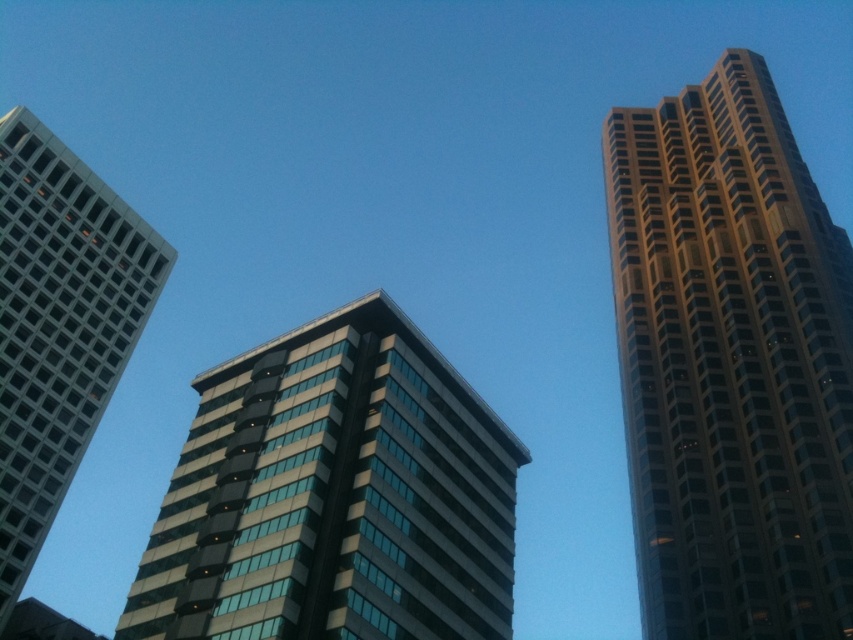
You are standing on the ground floor and want to take a photo of the gold glassy building at right and the matte glass skyscraper at left. Which building will appear larger in your photo?

The gold glassy building at right will appear larger in the photo because it is closer to the viewer than the matte glass skyscraper at left.

What is the significance of the point at coordinates (334,496) in the image?

The point at coordinates (334,496) marks the location of the glassy reflective building at center.